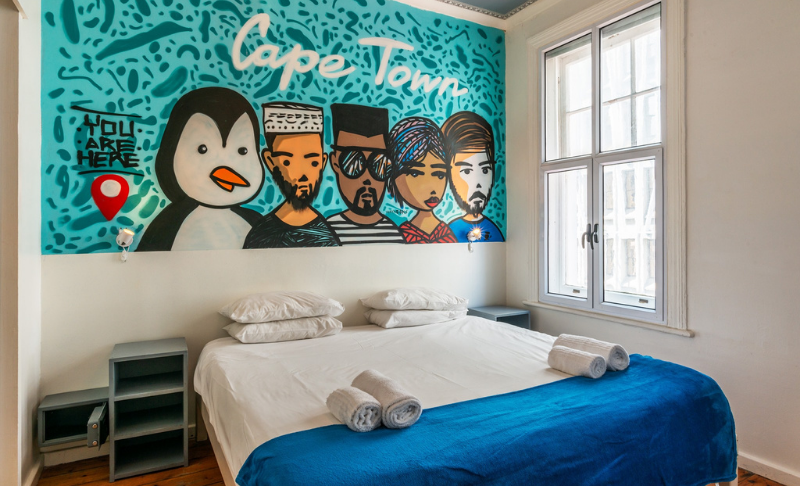
At what (x,y) coordinates should I click in order to perform the action: click on towel. Please return your answer as a coordinate pair (x, y). Image resolution: width=800 pixels, height=486 pixels. Looking at the image, I should click on (590, 366).